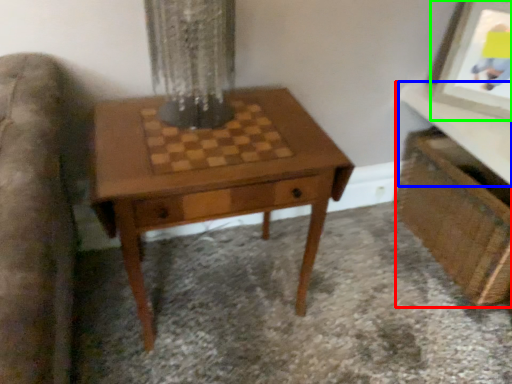
Question: Based on their relative distances, which object is nearer to vanity (highlighted by a red box)? Choose from table top (highlighted by a blue box) and picture frame (highlighted by a green box).

Choices:
 (A) table top
 (B) picture frame

Answer: (A)